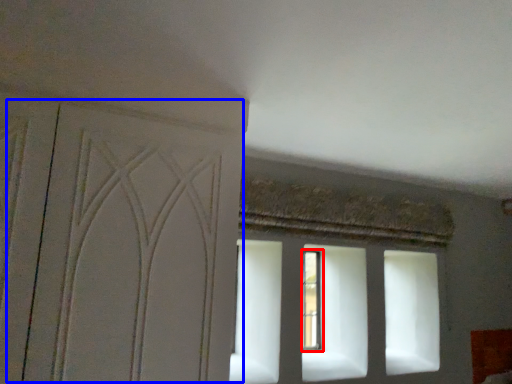
Question: Which of the following is the closest to the observer, window (highlighted by a red box) or screen door (highlighted by a blue box)?

Choices:
 (A) window
 (B) screen door

Answer: (B)